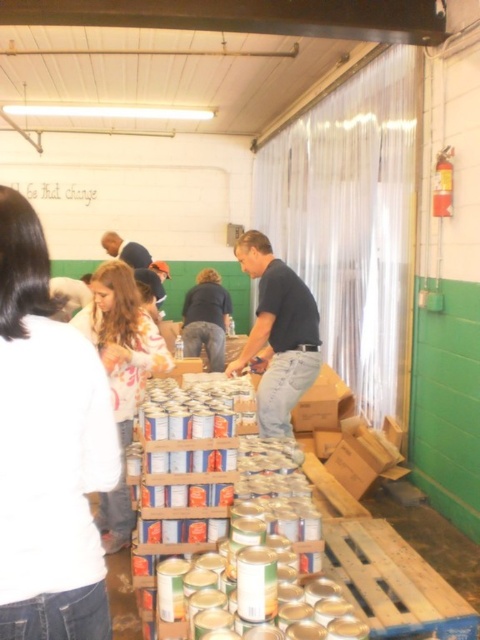
Question: Can you confirm if white cotton shirt at left is smaller than black cotton shirt at center?

Choices:
 (A) no
 (B) yes

Answer: (B)

Question: Can you confirm if black cotton shirt at center is bigger than dark blue shirt at center?

Choices:
 (A) no
 (B) yes

Answer: (A)

Question: Which of the following is the farthest from the observer?

Choices:
 (A) black cotton shirt at center
 (B) white cotton shirt at left
 (C) dark blue shirt at center

Answer: (C)

Question: Considering the real-world distances, which object is closest to the white cotton shirt at left?

Choices:
 (A) dark blue shirt at center
 (B) black cotton shirt at center

Answer: (B)

Question: Which object is the closest to the white cotton shirt at left?

Choices:
 (A) dark blue shirt at center
 (B) black cotton shirt at center

Answer: (B)

Question: Observing the image, what is the correct spatial positioning of black cotton shirt at center in reference to dark blue shirt at center?

Choices:
 (A) right
 (B) left

Answer: (A)